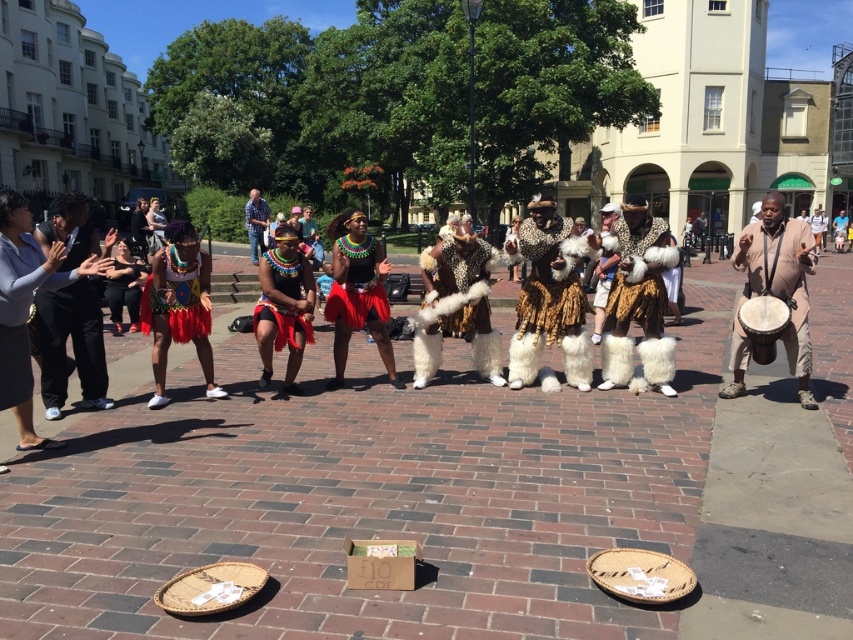
What do you see at coordinates (549, 298) in the screenshot? I see `brown fur coat at center` at bounding box center [549, 298].

Between point (540, 339) and point (82, 276), which one is positioned behind?

Positioned behind is point (540, 339).

What are the coordinates of `brown fur coat at center` in the screenshot? It's located at (549, 298).

Describe the element at coordinates (775, 291) in the screenshot. I see `brown leather drum at right` at that location.

Which of these two, brown leather drum at right or shiny red fabric skirt at center, stands taller?

brown leather drum at right

Does point (761, 291) come closer to viewer compared to point (194, 342)?

Yes, it is.

Image resolution: width=853 pixels, height=640 pixels. I want to click on brown leather drum at right, so tap(775, 291).

Who is shorter, black suit at left or shiny black fabric skirt at center?

With less height is black suit at left.

Is point (39, 365) behind point (345, 272)?

No, it is not.

Looking at this image, who is more forward, (x=61, y=392) or (x=364, y=298)?

Point (x=61, y=392) is in front.

The width and height of the screenshot is (853, 640). What are the coordinates of `black suit at left` in the screenshot? It's located at [73, 346].